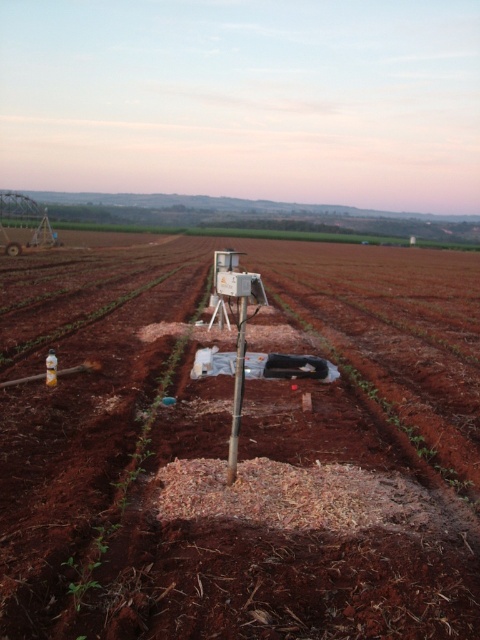
Question: Among these points, which one is farthest from the camera?

Choices:
 (A) (180, 540)
 (B) (240, 308)

Answer: (B)

Question: Which of the following is the farthest from the observer?

Choices:
 (A) (121, 321)
 (B) (243, 336)

Answer: (A)

Question: Is brown soil at center to the left of metallic pole at center from the viewer's perspective?

Choices:
 (A) no
 (B) yes

Answer: (A)

Question: Can you confirm if brown soil at center is bigger than metallic pole at center?

Choices:
 (A) yes
 (B) no

Answer: (A)

Question: Which point is farther from the camera taking this photo?

Choices:
 (A) (299, 620)
 (B) (233, 433)

Answer: (B)

Question: Can you confirm if brown soil at center is positioned above metallic pole at center?

Choices:
 (A) yes
 (B) no

Answer: (A)